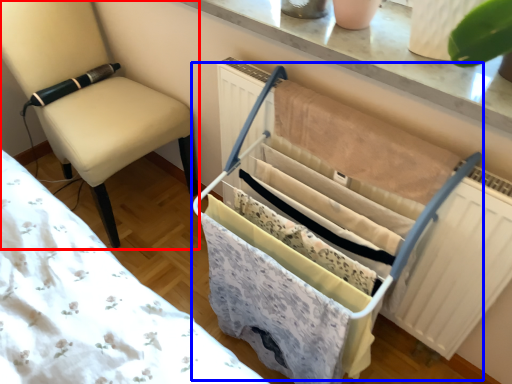
Question: Among these objects, which one is farthest to the camera, chair (highlighted by a red box) or baby carriage (highlighted by a blue box)?

Choices:
 (A) chair
 (B) baby carriage

Answer: (A)